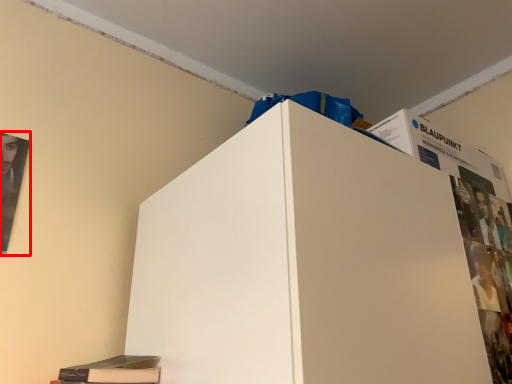
Question: From the image's perspective, where is poster page (annotated by the red box) located in relation to magazine in the image?

Choices:
 (A) above
 (B) below

Answer: (A)